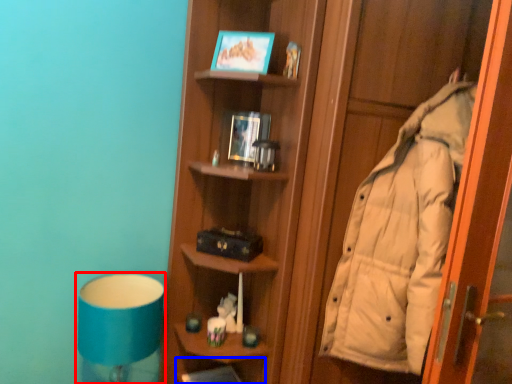
Question: Among these objects, which one is farthest to the camera, bedside lamp (highlighted by a red box) or shelf (highlighted by a blue box)?

Choices:
 (A) bedside lamp
 (B) shelf

Answer: (B)